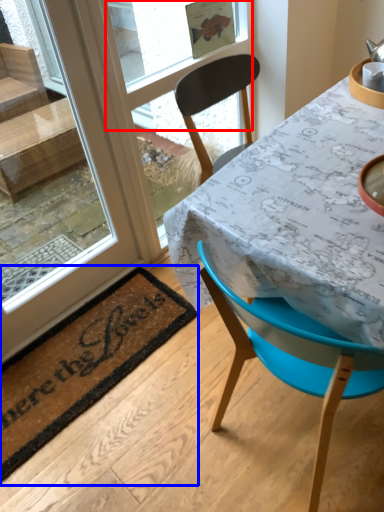
Question: Which object is closer to the camera taking this photo, window screen (highlighted by a red box) or mat (highlighted by a blue box)?

Choices:
 (A) window screen
 (B) mat

Answer: (B)